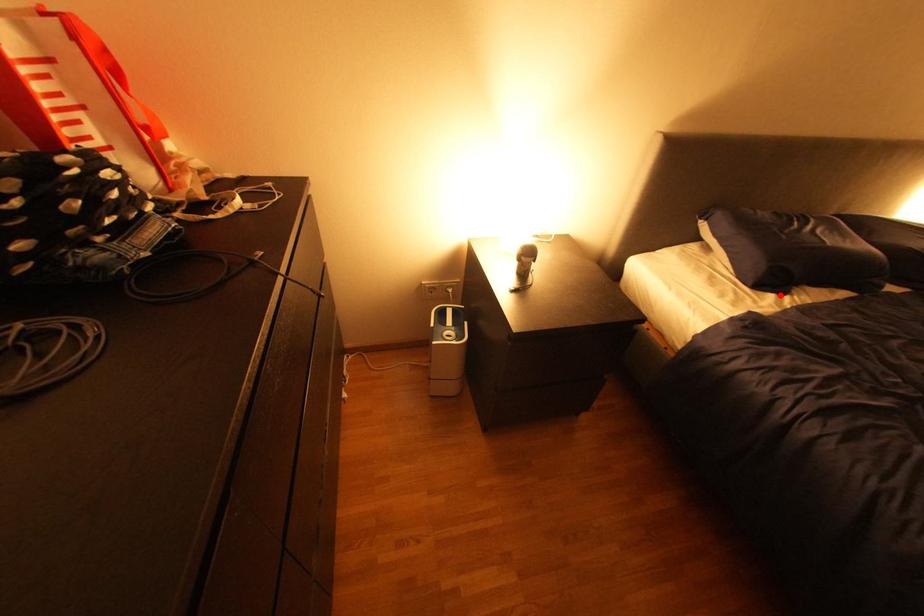
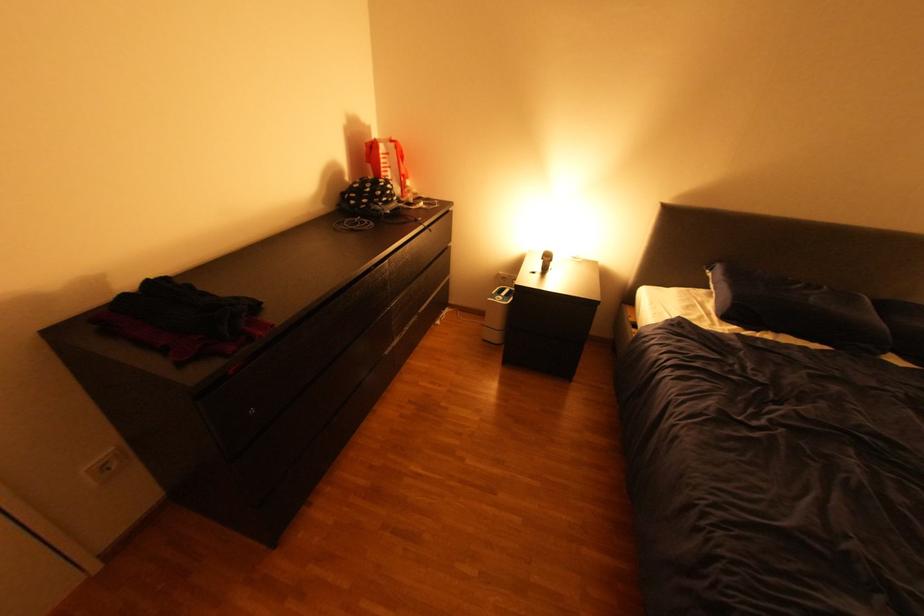
Where in the second image is the point corresponding to the highlighted location from the first image?

(745, 326)